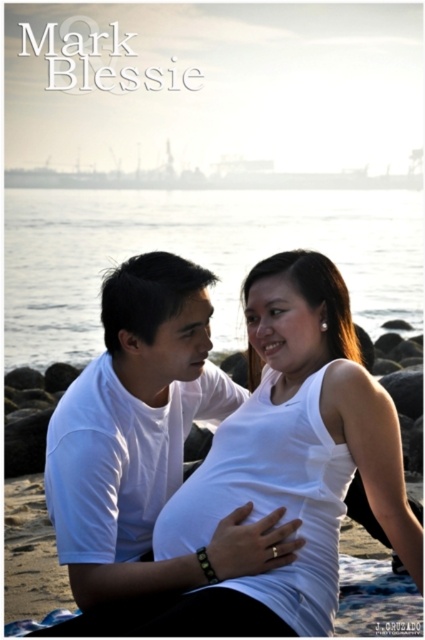
Looking at this image, you are a photographer trying to capture the sunset scene. You notice the white smooth tank top at center and the clear water at center. Which object is closer to the camera? Please explain your reasoning based on the scene description.

The white smooth tank top at center is in front of the clear water at center, so it is closer to the camera.

You are a photographer planning to take a sunset photo of the two people on the beach. The scene includes a white smooth tank top at center and clear water at center. Which object should you focus on first if you want to capture the reflection of the sunset in the water?

You should focus on the clear water at center first because the white smooth tank top at center is positioned on the right side of it, and the water is more likely to reflect the sunset.